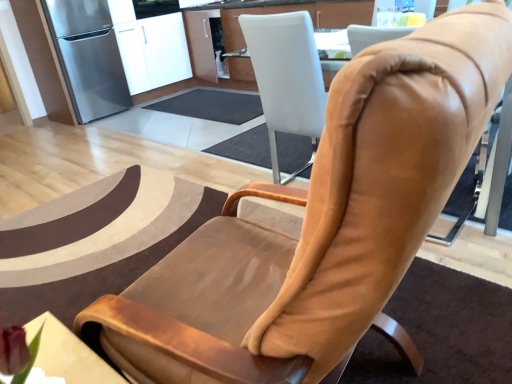
Identify the location of free spot to the right of stainless steel refrigerator at left. (148, 103).